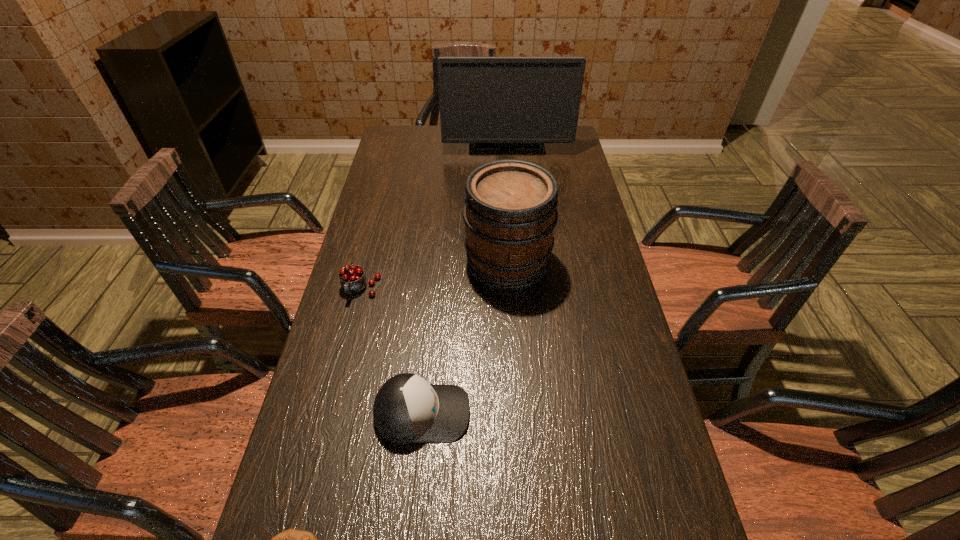
Locate an element on the screen. This screenshot has height=540, width=960. vacant area between the cherry and the computer monitor is located at coordinates (434, 217).

Identify the location of free space between the cherry and the cap. pos(392,351).

Image resolution: width=960 pixels, height=540 pixels. Find the location of `the second closest object to the cookie`. the second closest object to the cookie is located at coordinates click(352, 278).

Locate which object ranks third in proximity to the second tallest object. Please provide its 2D coordinates. Your answer should be formatted as a tuple, i.e. [(x, y)], where the tuple contains the x and y coordinates of a point satisfying the conditions above.

[(485, 101)]

Where is `free point that satisfies the following two spatial constraints: 1. on the screen side of the computer monitor; 2. on the front panel of the cap`? The height and width of the screenshot is (540, 960). free point that satisfies the following two spatial constraints: 1. on the screen side of the computer monitor; 2. on the front panel of the cap is located at coordinates (529, 413).